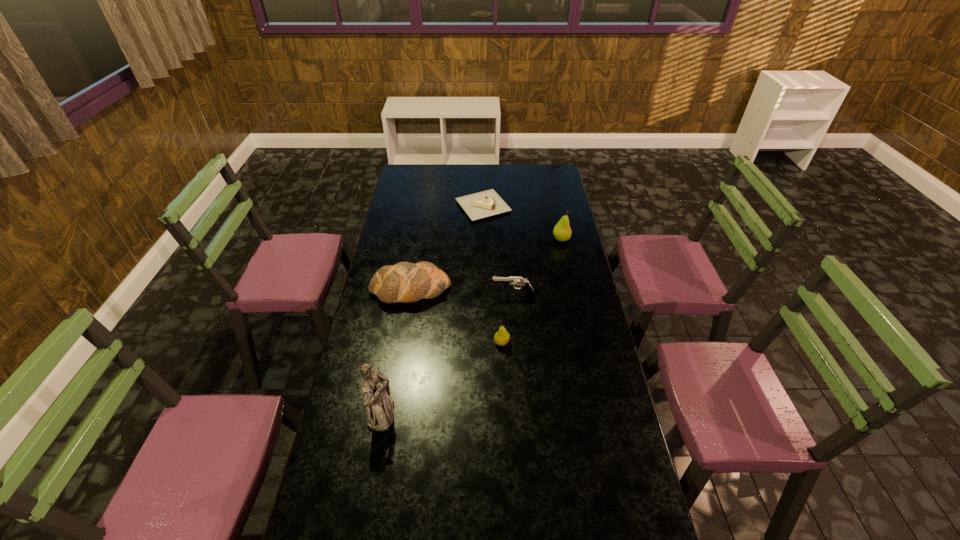
At what (x,y) coordinates should I click in order to perform the action: click on the shorter pear. Please return your answer as a coordinate pair (x, y). The width and height of the screenshot is (960, 540). Looking at the image, I should click on (501, 338).

This screenshot has height=540, width=960. Identify the location of the second nearest object. (501, 338).

Identify the location of the right pear. The image size is (960, 540). (562, 232).

The width and height of the screenshot is (960, 540). In order to click on the rightmost object in this screenshot , I will do `click(562, 232)`.

You are a GUI agent. You are given a task and a screenshot of the screen. Output one action in this format:
    pyautogui.click(x=<x>, y=<y>)
    Task: Click on the farthest object
    
    Given the screenshot: What is the action you would take?
    pyautogui.click(x=487, y=203)

In order to click on the shortest object in this screenshot , I will do `click(487, 203)`.

At what (x,y) coordinates should I click in order to perform the action: click on bread. Please return your answer as a coordinate pair (x, y). Looking at the image, I should click on (406, 282).

Locate an element on the screen. Image resolution: width=960 pixels, height=540 pixels. gun is located at coordinates (519, 281).

Identify the location of figurine. (379, 405).

Where is `the tallest object`? Image resolution: width=960 pixels, height=540 pixels. the tallest object is located at coordinates (379, 405).